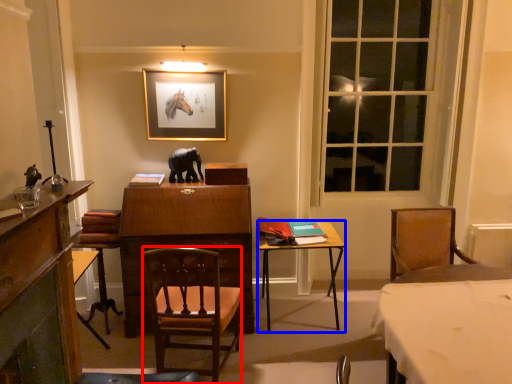
Question: Which object is further to the camera taking this photo, chair (highlighted by a red box) or table (highlighted by a blue box)?

Choices:
 (A) chair
 (B) table

Answer: (B)